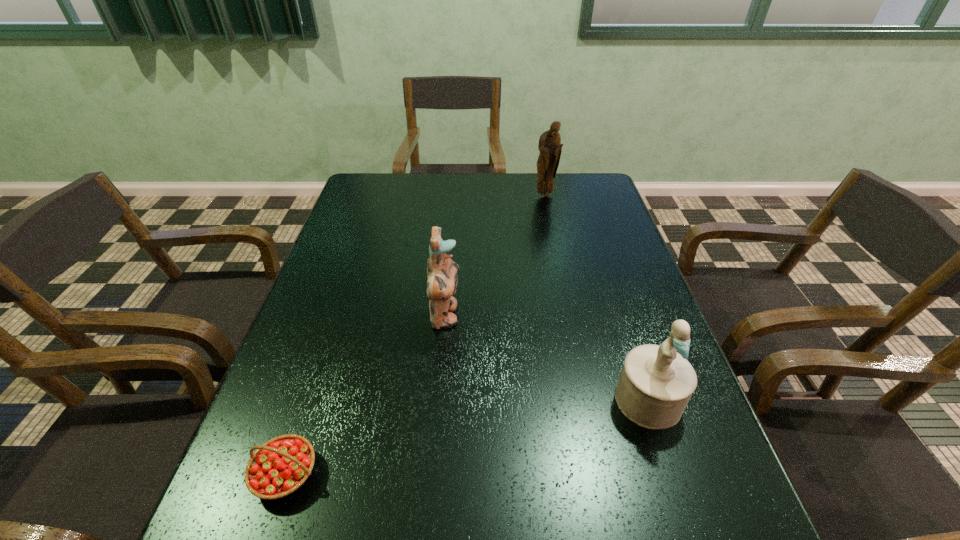
Where is `free space between the leftmost figurine and the farthest object`? free space between the leftmost figurine and the farthest object is located at coordinates (494, 256).

This screenshot has width=960, height=540. I want to click on empty space that is in between the second nearest object and the nearest object, so click(467, 437).

Where is `vacant area that lies between the rightmost figurine and the third nearest object`? This screenshot has width=960, height=540. vacant area that lies between the rightmost figurine and the third nearest object is located at coordinates (546, 358).

Find the location of a particular element. This screenshot has width=960, height=540. free point between the third nearest object and the leftmost object is located at coordinates (365, 395).

The width and height of the screenshot is (960, 540). Identify the location of free spot between the second object from left to right and the second object from right to left. (494, 256).

Where is `vacant space in between the rightmost figurine and the leftmost object`? The height and width of the screenshot is (540, 960). vacant space in between the rightmost figurine and the leftmost object is located at coordinates (467, 437).

You are a GUI agent. You are given a task and a screenshot of the screen. Output one action in this format:
    pyautogui.click(x=<x>, y=<y>)
    Task: Click on the vacant area that lies between the leftmost figurine and the nearest object
    This screenshot has height=540, width=960.
    Given the screenshot: What is the action you would take?
    pyautogui.click(x=365, y=395)

The image size is (960, 540). Find the location of `vacant area between the strawberry and the third farthest object`. vacant area between the strawberry and the third farthest object is located at coordinates (467, 437).

At what (x,y) coordinates should I click in order to perform the action: click on vacant region between the rightmost object and the second object from right to left. Please return your answer as a coordinate pair (x, y). This screenshot has height=540, width=960. Looking at the image, I should click on (596, 298).

This screenshot has width=960, height=540. I want to click on vacant space that is in between the nearest figurine and the leftmost object, so click(x=467, y=437).